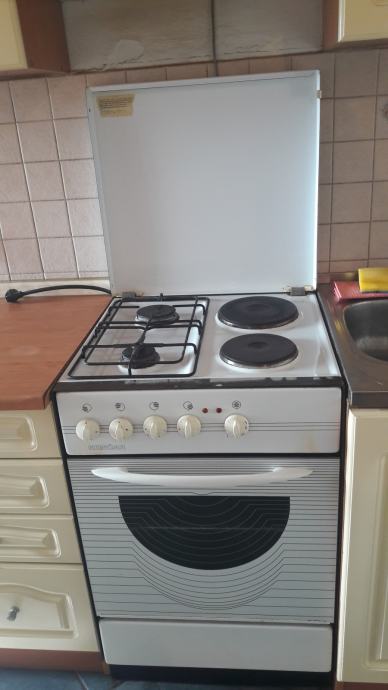
The width and height of the screenshot is (388, 690). Identify the location of back gas cooktop burner. (162, 315).